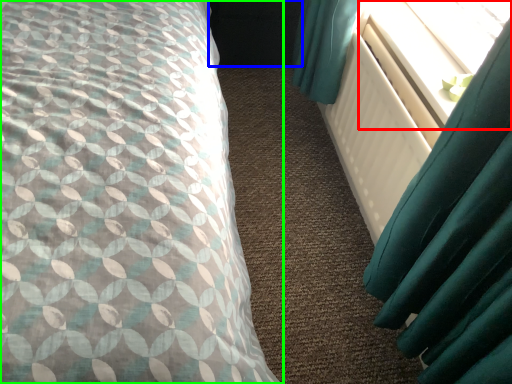
Question: Estimate the real-world distances between objects in this image. Which object is closer to window screen (highlighted by a red box), dark (highlighted by a blue box) or bed (highlighted by a green box)?

Choices:
 (A) dark
 (B) bed

Answer: (B)